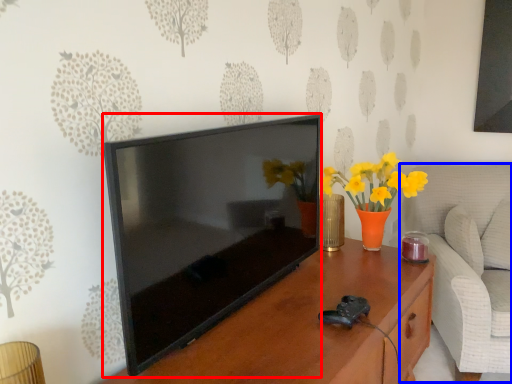
Question: Which point is closer to the camera, television (highlighted by a red box) or swivel chair (highlighted by a blue box)?

Choices:
 (A) television
 (B) swivel chair

Answer: (A)